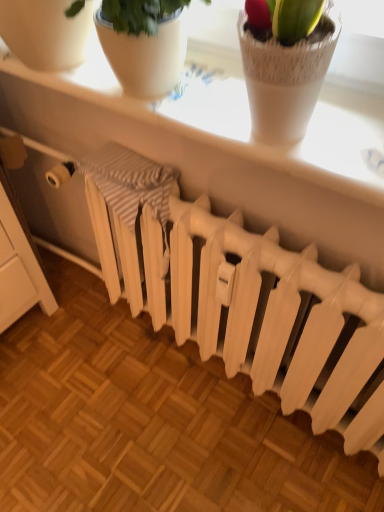
Question: Can you confirm if white textured window sill at upper center is smaller than white matte radiator at center?

Choices:
 (A) yes
 (B) no

Answer: (A)

Question: Is white textured window sill at upper center completely or partially outside of white matte radiator at center?

Choices:
 (A) no
 (B) yes

Answer: (B)

Question: Is white matte radiator at center at the back of white textured window sill at upper center?

Choices:
 (A) no
 (B) yes

Answer: (A)

Question: Is white textured window sill at upper center closer to camera compared to white matte radiator at center?

Choices:
 (A) no
 (B) yes

Answer: (B)

Question: Is the surface of white textured window sill at upper center in direct contact with white matte radiator at center?

Choices:
 (A) no
 (B) yes

Answer: (A)

Question: From the image's perspective, is white textured window sill at upper center under white matte radiator at center?

Choices:
 (A) yes
 (B) no

Answer: (B)

Question: Considering the relative positions of white matte radiator at center and white textured window sill at upper center in the image provided, is white matte radiator at center to the left of white textured window sill at upper center from the viewer's perspective?

Choices:
 (A) no
 (B) yes

Answer: (A)

Question: Does white matte radiator at center have a lesser width compared to white textured window sill at upper center?

Choices:
 (A) no
 (B) yes

Answer: (B)

Question: Are white matte radiator at center and white textured window sill at upper center located far from each other?

Choices:
 (A) yes
 (B) no

Answer: (B)

Question: Are white matte radiator at center and white textured window sill at upper center making contact?

Choices:
 (A) yes
 (B) no

Answer: (B)

Question: Considering the relative sizes of white matte radiator at center and white textured window sill at upper center in the image provided, is white matte radiator at center wider than white textured window sill at upper center?

Choices:
 (A) yes
 (B) no

Answer: (B)

Question: From the image's perspective, does white matte radiator at center appear lower than white textured window sill at upper center?

Choices:
 (A) no
 (B) yes

Answer: (B)

Question: From a real-world perspective, relative to white matte radiator at center, is white textured window sill at upper center vertically above or below?

Choices:
 (A) above
 (B) below

Answer: (A)